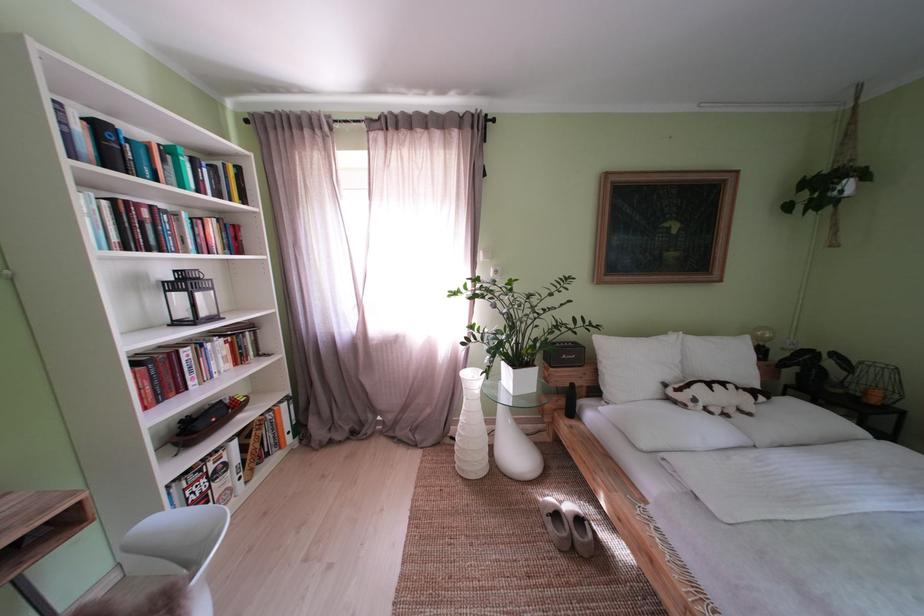
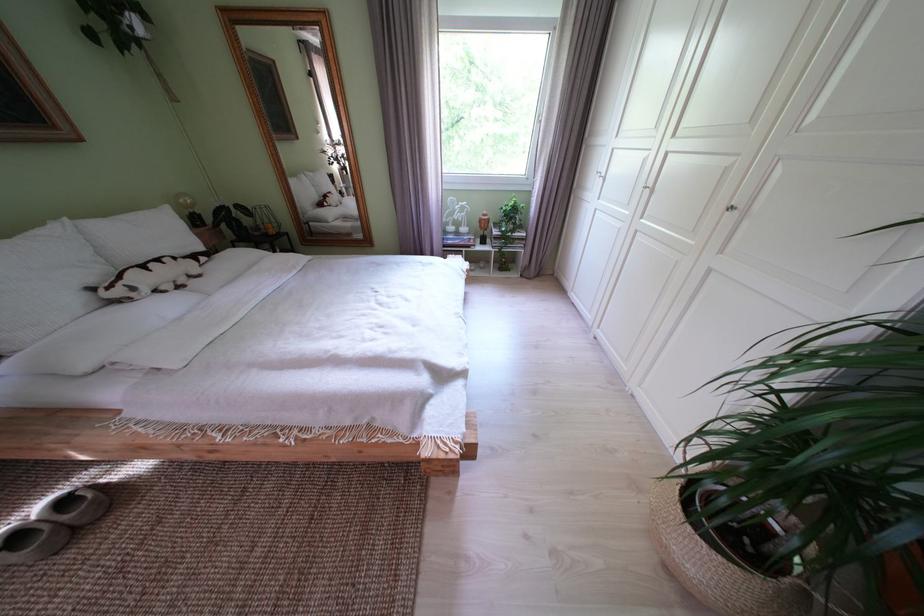
Locate, in the second image, the point that corresponds to (x=567, y=521) in the first image.

(28, 543)